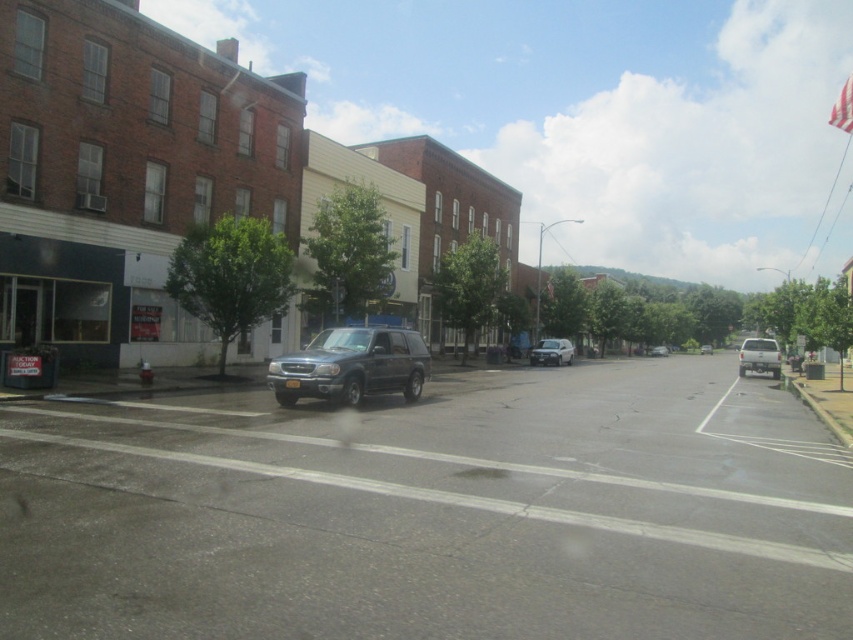
Question: Estimate the real-world distances between objects in this image. Which object is farther from the white matte car at center?

Choices:
 (A) gray matte suv at center
 (B) silver metallic suv at center
 (C) metallic silver suv at center
 (D) matte gray suv at right

Answer: (B)

Question: Estimate the real-world distances between objects in this image. Which object is closer to the matte gray suv at right?

Choices:
 (A) white matte car at center
 (B) silver metallic suv at center
 (C) gray matte suv at center
 (D) satin blue suv at center

Answer: (A)

Question: Can you confirm if white matte car at center is bigger than metallic silver suv at center?

Choices:
 (A) yes
 (B) no

Answer: (A)

Question: Which of the following is the farthest from the observer?

Choices:
 (A) white matte car at center
 (B) satin blue suv at center

Answer: (A)

Question: Does satin blue suv at center appear under matte gray suv at right?

Choices:
 (A) yes
 (B) no

Answer: (B)

Question: Is satin blue suv at center above white matte car at center?

Choices:
 (A) no
 (B) yes

Answer: (B)